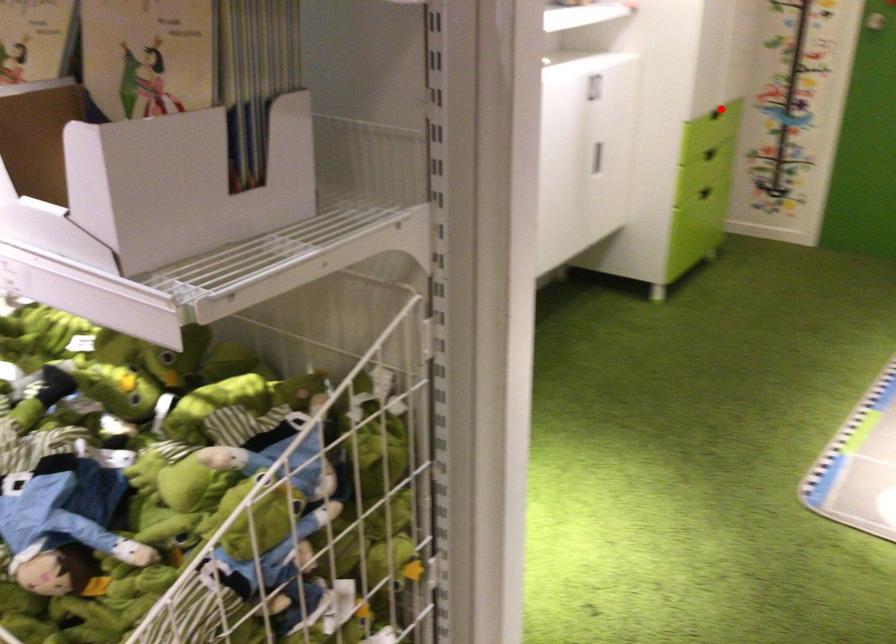
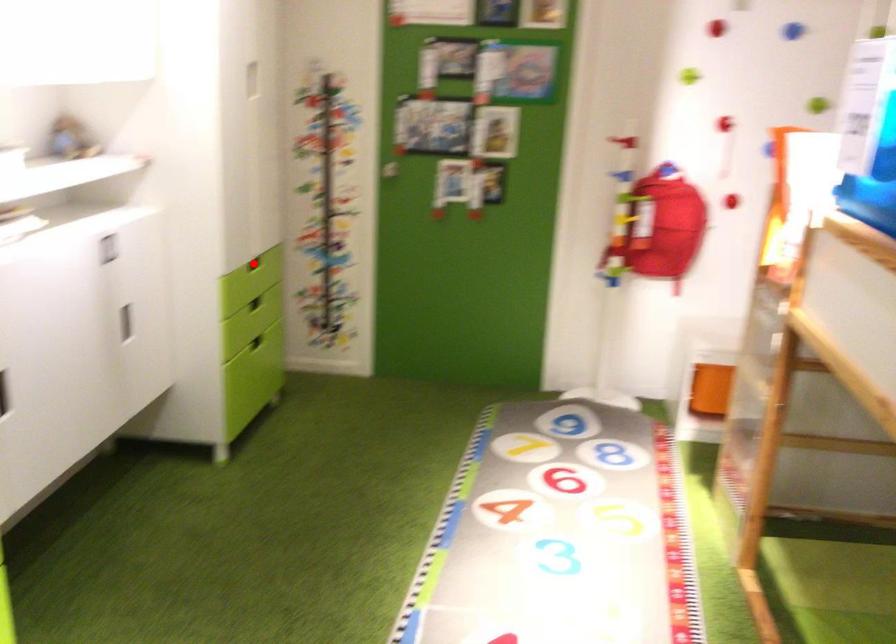
I am providing you with two images of the same scene from different viewpoints. A red point is marked on the first image and another point is marked on the second image. Do the highlighted points in image1 and image2 indicate the same real-world spot?

Yes